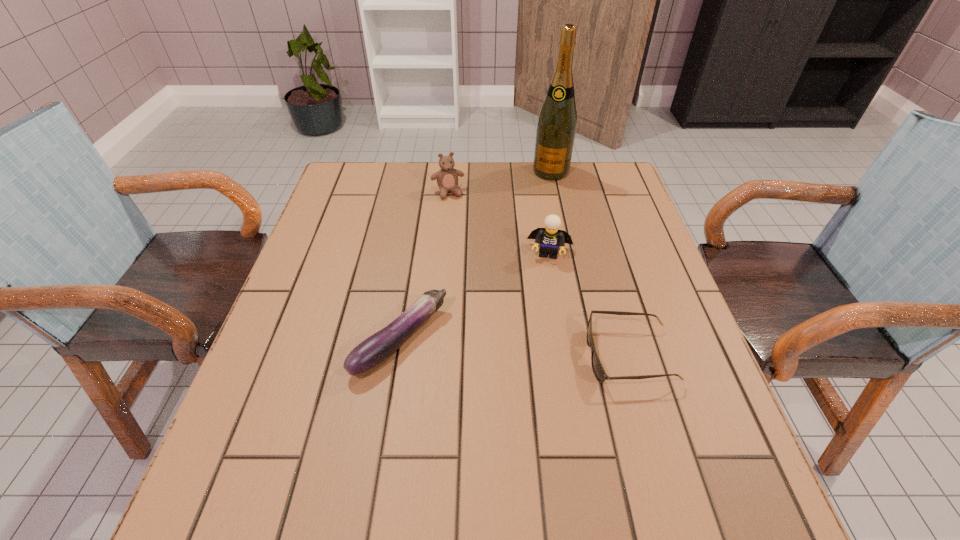
Find the location of a particular element. This screenshot has height=540, width=960. free spot between the farthest object and the second shortest object is located at coordinates (476, 256).

Where is `unoccupied area between the shortest object and the second shortest object`? unoccupied area between the shortest object and the second shortest object is located at coordinates (515, 348).

Locate an element on the screen. free area in between the fourth nearest object and the sunglasses is located at coordinates (539, 274).

Where is `vacant space in between the second shortest object and the fourth nearest object`? The width and height of the screenshot is (960, 540). vacant space in between the second shortest object and the fourth nearest object is located at coordinates (424, 267).

At what (x,y) coordinates should I click in order to perform the action: click on empty space that is in between the sunglasses and the eggplant. Please return your answer as a coordinate pair (x, y). Looking at the image, I should click on (515, 348).

Where is `free point between the third nearest object and the second shortest object`? free point between the third nearest object and the second shortest object is located at coordinates (475, 297).

Where is `blank region between the shortest object and the farthest object`? blank region between the shortest object and the farthest object is located at coordinates (590, 264).

Locate an element on the screen. The height and width of the screenshot is (540, 960). unoccupied position between the eggplant and the farthest object is located at coordinates (476, 256).

Select which object is the closest to the Lego. Please provide its 2D coordinates. Your answer should be formatted as a tuple, i.e. [(x, y)], where the tuple contains the x and y coordinates of a point satisfying the conditions above.

[(598, 370)]

Identify which object is the second nearest to the teddy bear. Please provide its 2D coordinates. Your answer should be formatted as a tuple, i.e. [(x, y)], where the tuple contains the x and y coordinates of a point satisfying the conditions above.

[(550, 237)]